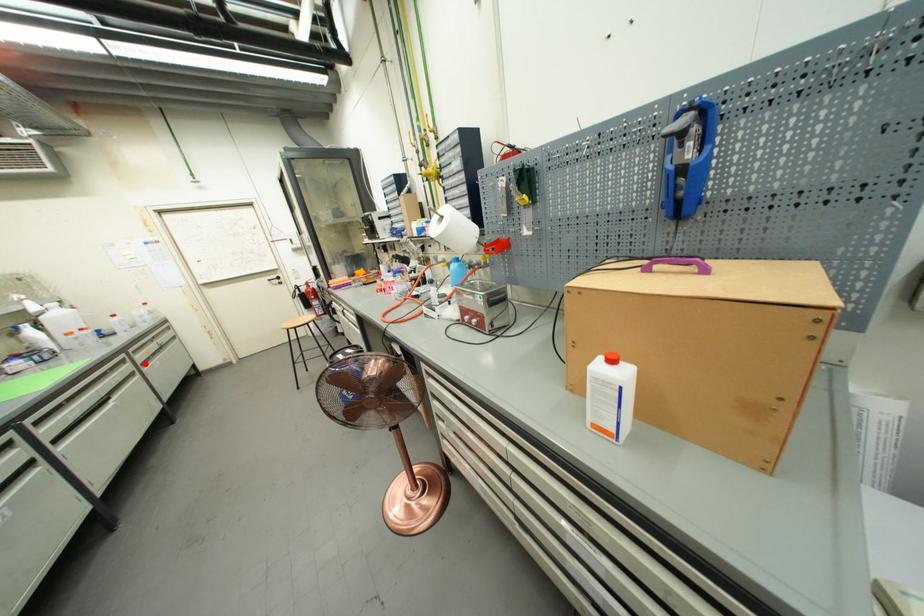
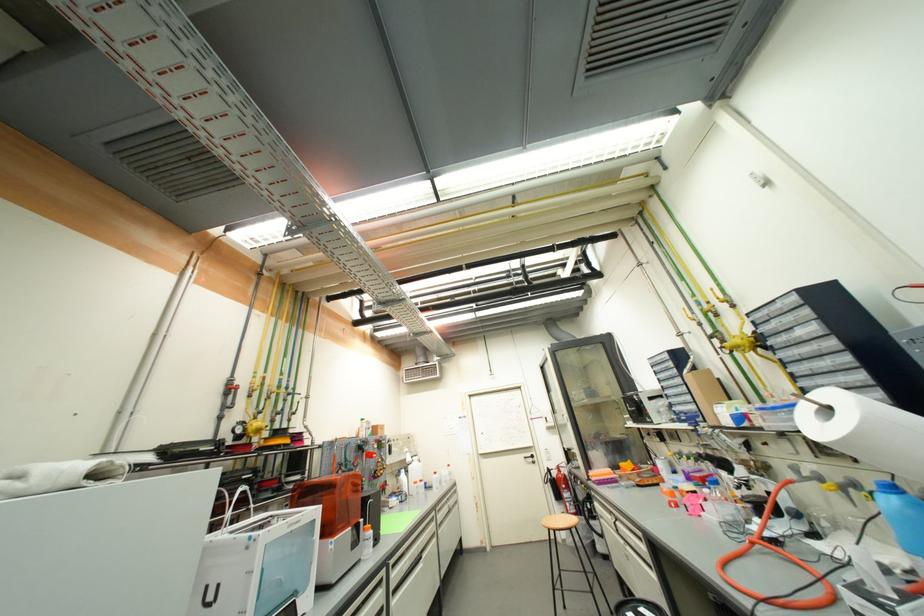
Find the pixel in the second image that matches the highlighted location in the first image.

(444, 525)